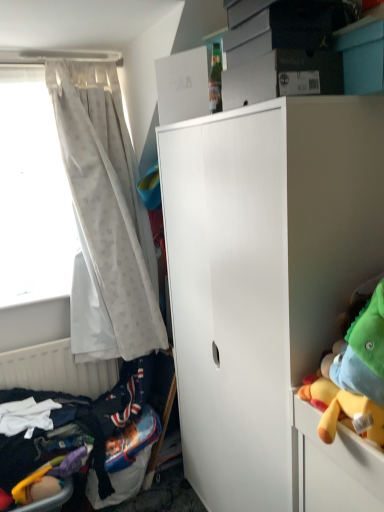
Question: Is white matte radiator at lower left inside the boundaries of white matte cabinet at center, or outside?

Choices:
 (A) inside
 (B) outside

Answer: (B)

Question: In terms of height, does white matte radiator at lower left look taller or shorter compared to white matte cabinet at center?

Choices:
 (A) short
 (B) tall

Answer: (A)

Question: Based on their relative distances, which object is nearer to the dark blue fabric bed at lower left?

Choices:
 (A) white sheer curtain at left
 (B) white matte radiator at lower left
 (C) white sheer curtain at left
 (D) white matte cabinet at center

Answer: (B)

Question: Which object is positioned farthest from the dark blue fabric bed at lower left?

Choices:
 (A) white sheer curtain at left
 (B) white sheer curtain at left
 (C) white matte radiator at lower left
 (D) white matte cabinet at center

Answer: (D)